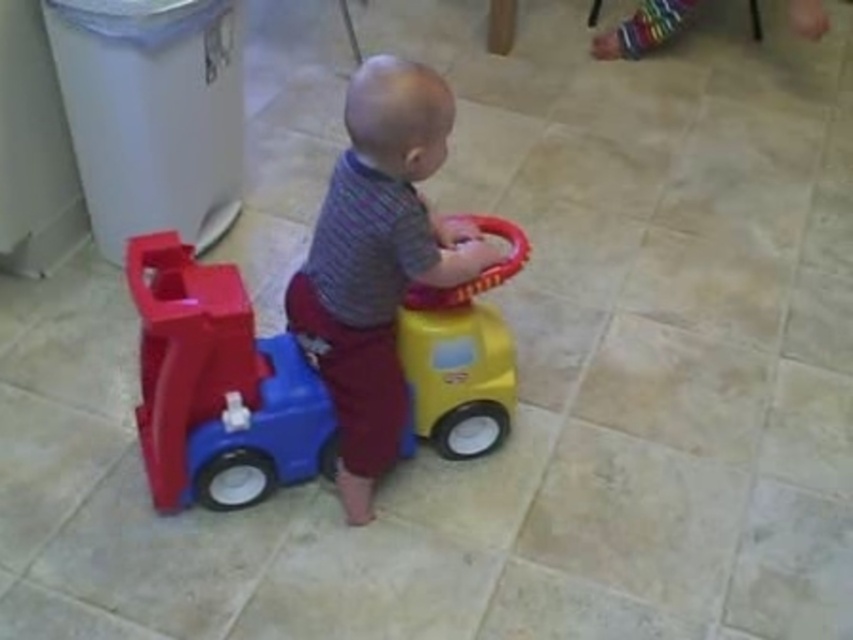
Does matte plastic car at center appear under matte plastic toy car at center?

Yes, matte plastic car at center is below matte plastic toy car at center.

Can you confirm if matte plastic car at center is taller than matte plastic toy car at center?

In fact, matte plastic car at center may be shorter than matte plastic toy car at center.

Is point (514, 253) farther from camera compared to point (345, 154)?

That is True.

Where is `matte plastic car at center`? matte plastic car at center is located at coordinates (218, 385).